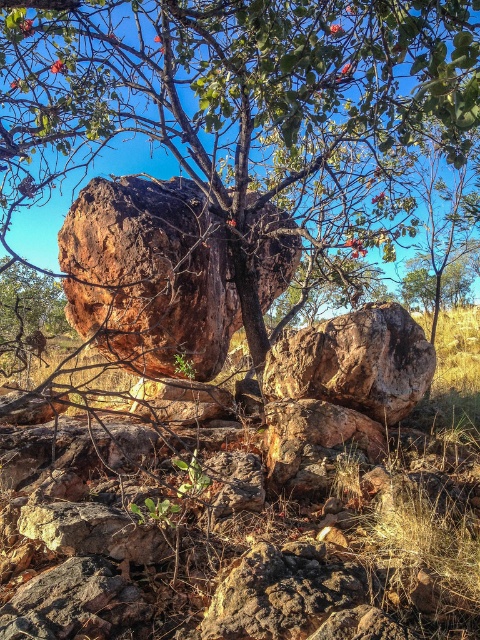
Does point (136, 284) come in front of point (417, 356)?

That is False.

Who is more distant from viewer, (63, 260) or (405, 380)?

The point (63, 260) is more distant.

Locate an element on the screen. rusty brown rock at center is located at coordinates (148, 275).

Does brown rough rock at center appear on the left side of rustic brown rock at center?

Indeed, brown rough rock at center is positioned on the left side of rustic brown rock at center.

Where is `brown rough rock at center`? The image size is (480, 640). brown rough rock at center is located at coordinates (240, 102).

Does point (298, 26) come behind point (422, 340)?

No, it is in front of (422, 340).

Identify the location of brown rough rock at center. (240, 102).

Between point (348, 17) and point (216, 307), which one is positioned behind?

Point (348, 17)

Does point (432, 92) come in front of point (137, 244)?

Yes, point (432, 92) is in front of point (137, 244).

Is point (254, 346) behind point (180, 339)?

Yes, it is behind point (180, 339).

At what (x,y) coordinates should I click in order to perform the action: click on brown rough rock at center. Please return your answer as a coordinate pair (x, y). The height and width of the screenshot is (640, 480). Looking at the image, I should click on (240, 102).